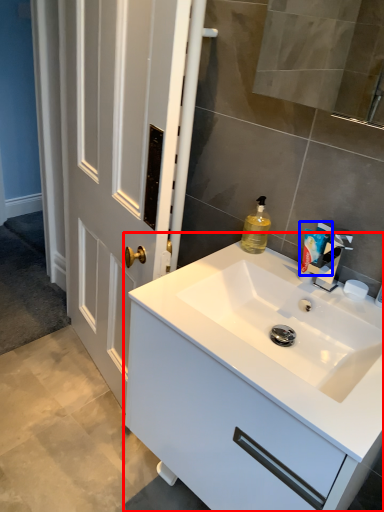
Question: Which point is further to the camera, bathroom cabinet (highlighted by a red box) or toiletry (highlighted by a blue box)?

Choices:
 (A) bathroom cabinet
 (B) toiletry

Answer: (B)